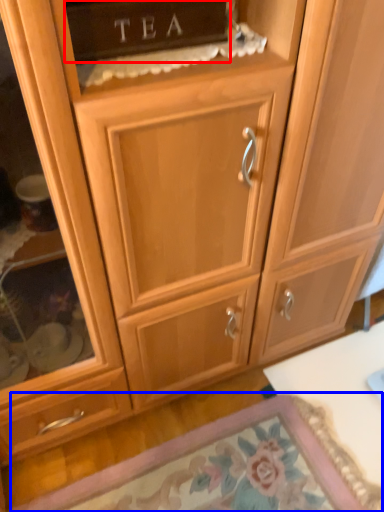
Question: Among these objects, which one is nearest to the camera, cabinetry (highlighted by a red box) or door (highlighted by a blue box)?

Choices:
 (A) cabinetry
 (B) door

Answer: (A)